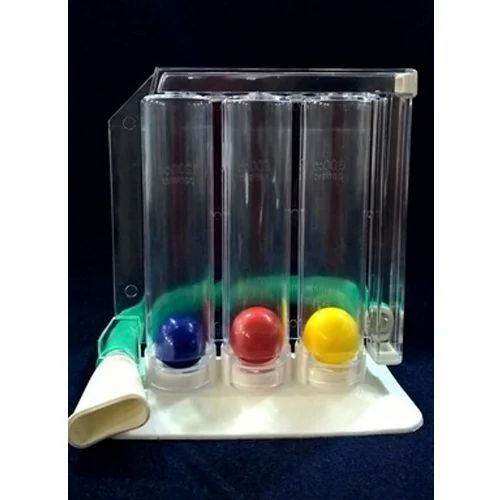
Locate an element on the screen. table is located at coordinates (227, 468).